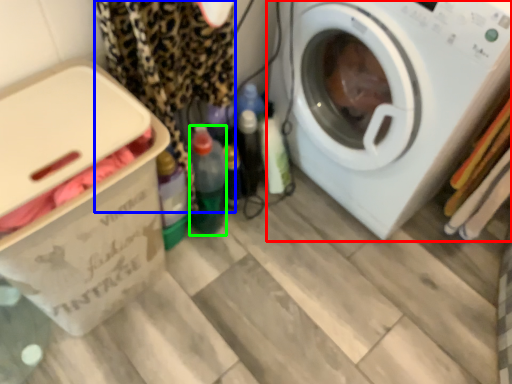
Question: Based on their relative distances, which object is nearer to washing machine (highlighted by a red box)? Choose from clothing (highlighted by a blue box) and bottle (highlighted by a green box).

Choices:
 (A) clothing
 (B) bottle

Answer: (A)